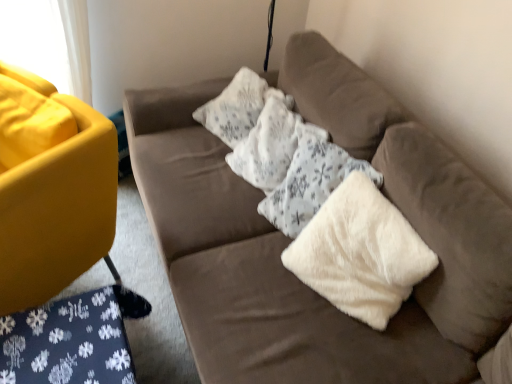
Question: In terms of size, does velvet brown couch at center, which is the 2th studio couch from left to right, appear bigger or smaller than white fluffy pillow at center?

Choices:
 (A) small
 (B) big

Answer: (B)

Question: Based on their positions, is velvet brown couch at center, arranged as the 1th studio couch when viewed from the right, located to the left or right of white fluffy pillow at center?

Choices:
 (A) right
 (B) left

Answer: (A)

Question: Which of these objects is positioned farthest from the white fluffy pillow at center?

Choices:
 (A) white fluffy pillow at center
 (B) velvet brown couch at center, arranged as the 1th studio couch when viewed from the right
 (C) matte yellow couch at left, which is the 1th studio couch from left to right

Answer: (C)

Question: Which of these objects is positioned closest to the velvet brown couch at center, which is the 2th studio couch from left to right?

Choices:
 (A) white fluffy pillow at center
 (B) white fluffy pillow at center
 (C) matte yellow couch at left, marked as the 2th studio couch in a right-to-left arrangement

Answer: (A)